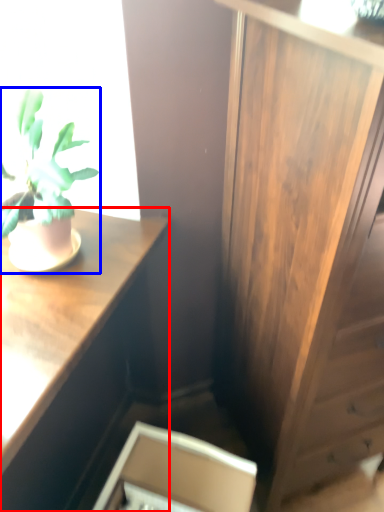
Question: Which object appears closest to the camera in this image, desk (highlighted by a red box) or houseplant (highlighted by a blue box)?

Choices:
 (A) desk
 (B) houseplant

Answer: (B)